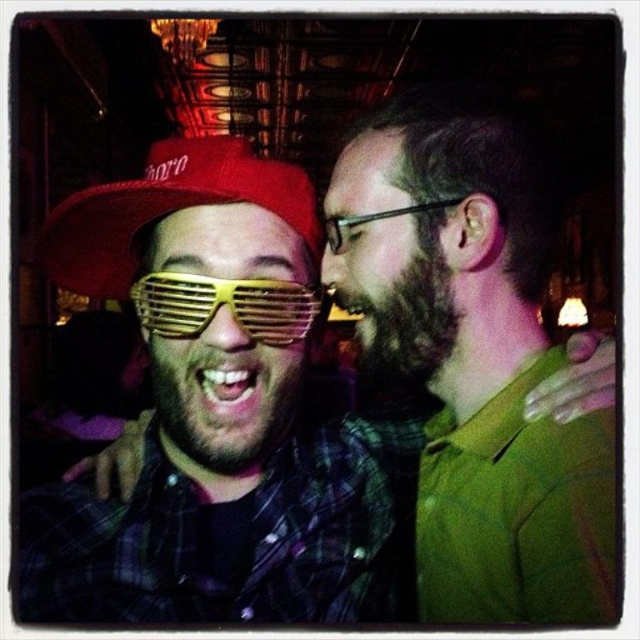
You are a photographer standing in the same room as the two people in the image. You want to take a photo of the point at coordinates point (506,218). What is the minimum distance you need to maintain to ensure the point is in focus?

The minimum distance you need to maintain is 27.97 inches because the distance of point (506,218) from camera is 27.97 inches.

You are a photographer trying to capture a candid shot of the matte yellow plastic sunglasses at center and the matte red baseball cap at left. Since you want to ensure both are in focus, which object should you focus on first to maintain clarity?

The matte yellow plastic sunglasses at center is in front of the matte red baseball cap at left. To ensure both are in focus, you should focus on the matte yellow plastic sunglasses at center first, as it is closer to the camera, and the depth of field will naturally include the matte red baseball cap at left behind it.

You are a bartender at the bar. You need to place a small coaster between the gold metallic goggles at center and the dark brown fuzzy beard at right. Can you fit it there?

The gold metallic goggles at center is larger than the dark brown fuzzy beard at right, so there might not be enough space to fit a coaster between them.